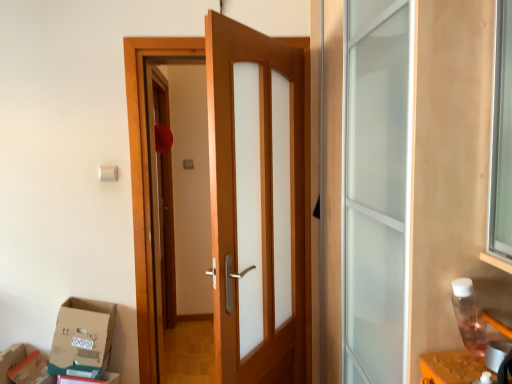
Question: Does wooden door at center have a lesser height compared to teal cardboard box at lower left, which ranks as the 2th cardboard box in right-to-left order?

Choices:
 (A) no
 (B) yes

Answer: (A)

Question: Is wooden door at center positioned far away from teal cardboard box at lower left, which ranks as the 2th cardboard box in right-to-left order?

Choices:
 (A) no
 (B) yes

Answer: (A)

Question: Is wooden door at center aimed at teal cardboard box at lower left, which ranks as the 2th cardboard box in right-to-left order?

Choices:
 (A) no
 (B) yes

Answer: (A)

Question: From a real-world perspective, is wooden door at center physically below teal cardboard box at lower left, which appears as the 1th cardboard box when viewed from the left?

Choices:
 (A) yes
 (B) no

Answer: (B)

Question: Does wooden door at center have a smaller size compared to teal cardboard box at lower left, which ranks as the 2th cardboard box in right-to-left order?

Choices:
 (A) no
 (B) yes

Answer: (A)

Question: Is wooden door at center wider than teal cardboard box at lower left, which appears as the 1th cardboard box when viewed from the left?

Choices:
 (A) yes
 (B) no

Answer: (A)

Question: Does cardboard box at lower left, the 1th cardboard box positioned from the right, appear on the right side of wooden door at center?

Choices:
 (A) no
 (B) yes

Answer: (A)

Question: From a real-world perspective, is cardboard box at lower left, which is the 2th cardboard box from left to right, positioned over wooden door at center based on gravity?

Choices:
 (A) no
 (B) yes

Answer: (A)

Question: Does cardboard box at lower left, the 1th cardboard box positioned from the right, have a larger size compared to wooden door at center?

Choices:
 (A) yes
 (B) no

Answer: (B)

Question: Does cardboard box at lower left, the 1th cardboard box positioned from the right, turn towards wooden door at center?

Choices:
 (A) yes
 (B) no

Answer: (B)

Question: Is the position of cardboard box at lower left, which is the 2th cardboard box from left to right, less distant than that of wooden door at center?

Choices:
 (A) no
 (B) yes

Answer: (B)

Question: Is cardboard box at lower left, which is the 2th cardboard box from left to right, placed right next to wooden door at center?

Choices:
 (A) no
 (B) yes

Answer: (A)

Question: Considering the relative positions of wooden door at center and cardboard box at lower left, the 1th cardboard box positioned from the right, in the image provided, is wooden door at center behind cardboard box at lower left, the 1th cardboard box positioned from the right,?

Choices:
 (A) no
 (B) yes

Answer: (B)